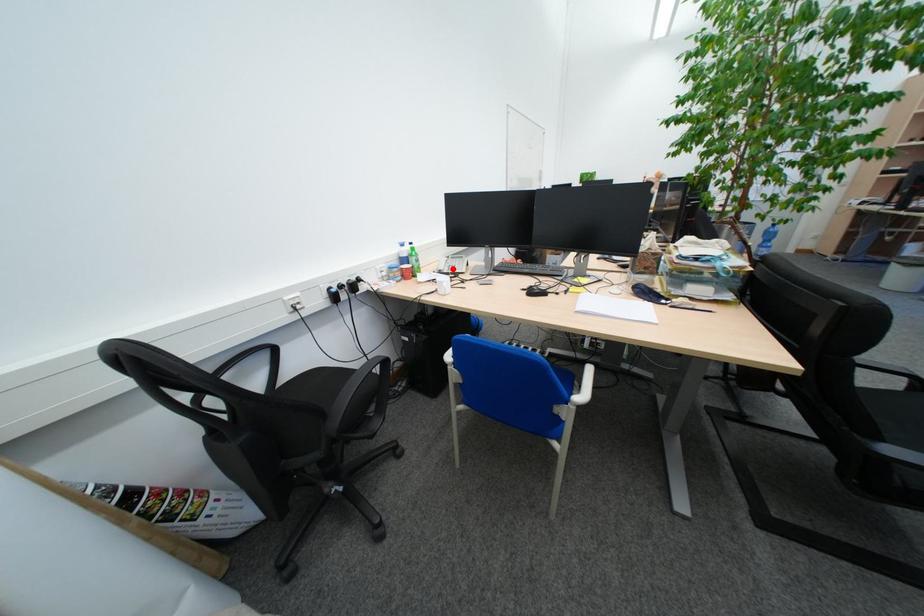
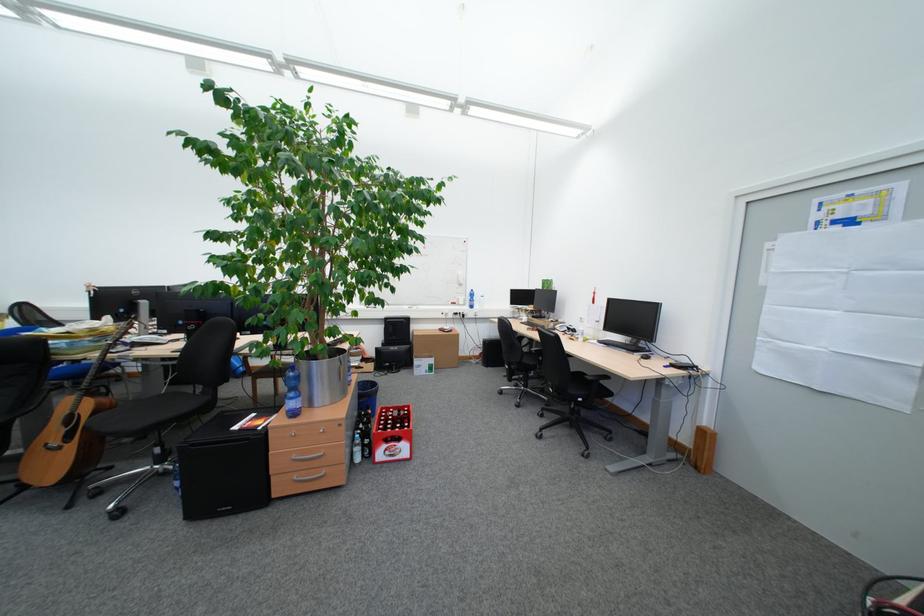
Question: I am providing you with two images of the same scene from different viewpoints. A red point is marked on the first image. At the location where the point appears in image 1, is it still visible in image 2?

Choices:
 (A) Yes
 (B) No

Answer: (B)